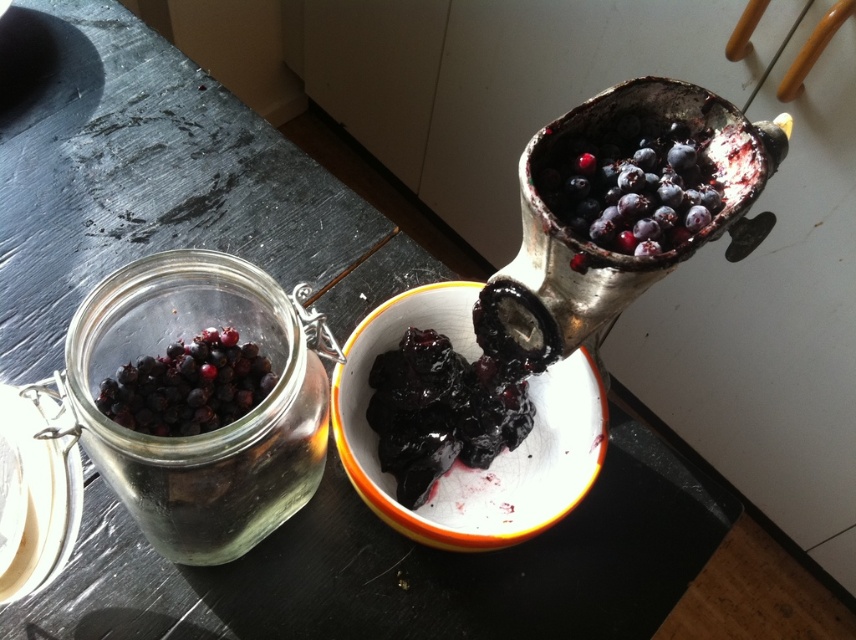
Question: Among these objects, which one is nearest to the camera?

Choices:
 (A) glossy glass jar at left
 (B) transparent glass jar at left

Answer: (B)

Question: Based on their relative distances, which object is farther from the shiny dark blue berries at upper right?

Choices:
 (A) glossy glass jar at left
 (B) matte white bowl at center
 (C) shiny dark purple berries at center

Answer: (A)

Question: Is shiny dark purple berries at center wider than glossy glass jar at left?

Choices:
 (A) yes
 (B) no

Answer: (A)

Question: Does transparent glass jar at left have a smaller size compared to glossy glass jar at left?

Choices:
 (A) yes
 (B) no

Answer: (B)

Question: Which point is closer to the camera?

Choices:
 (A) pyautogui.click(x=492, y=406)
 (B) pyautogui.click(x=354, y=444)

Answer: (B)

Question: Is matte white bowl at center above shiny dark purple berries at center?

Choices:
 (A) yes
 (B) no

Answer: (B)